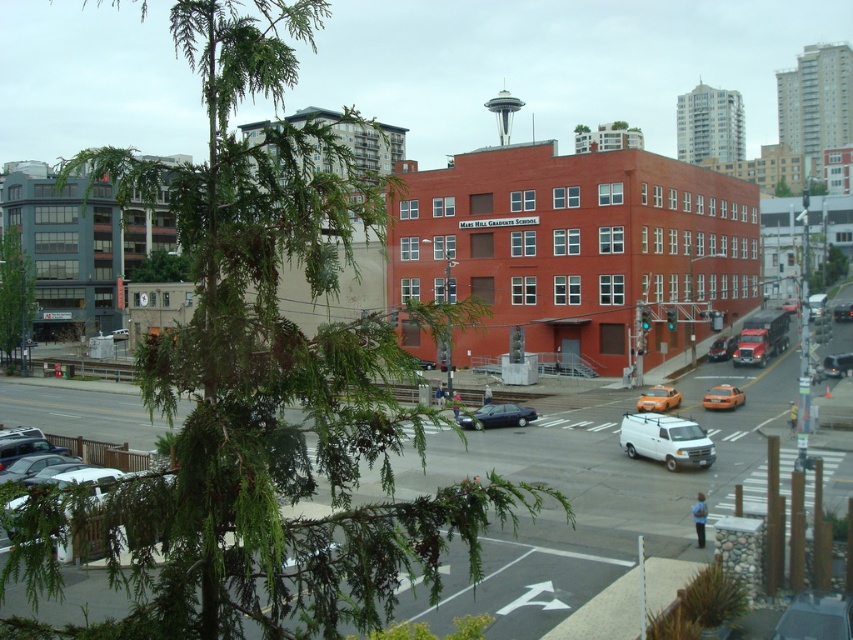
Who is taller, orange matte taxi at center or metallic silver sedan at center-right?

metallic silver sedan at center-right is taller.

Who is more distant from viewer, (641, 403) or (717, 342)?

Positioned behind is point (717, 342).

What are the coordinates of `orange matte taxi at center` in the screenshot? It's located at (659, 397).

Can you confirm if green leafy tree at center is positioned to the left of matte orange car at center?

Yes, green leafy tree at center is to the left of matte orange car at center.

Does green leafy tree at center appear over matte orange car at center?

Correct, green leafy tree at center is located above matte orange car at center.

The image size is (853, 640). What are the coordinates of `green leafy tree at center` in the screenshot? It's located at (161, 268).

Does white matte van at center have a lesser width compared to green leafy tree at left?

Correct, white matte van at center's width is less than green leafy tree at left's.

Does white matte van at center come in front of green leafy tree at left?

Yes, it is.

Who is more distant from viewer, (662,449) or (0,339)?

Point (0,339)

Find the location of a particular element. The width and height of the screenshot is (853, 640). white matte van at center is located at coordinates (665, 440).